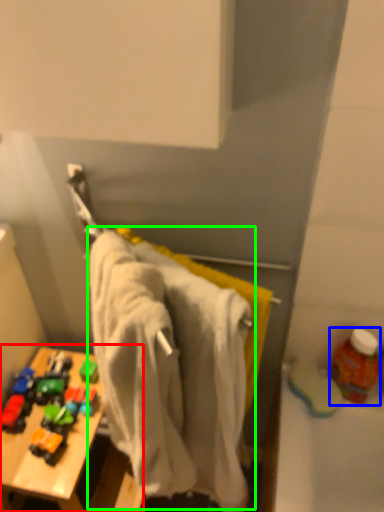
Question: Which object is the farthest from table (highlighted by a red box)? Choose among these: bottle (highlighted by a blue box) or bath towel (highlighted by a green box).

Choices:
 (A) bottle
 (B) bath towel

Answer: (A)